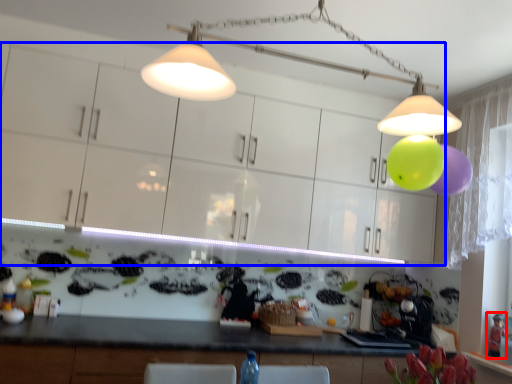
Question: Which object is further to the camera taking this photo, toy (highlighted by a red box) or cabinetry (highlighted by a blue box)?

Choices:
 (A) toy
 (B) cabinetry

Answer: (A)